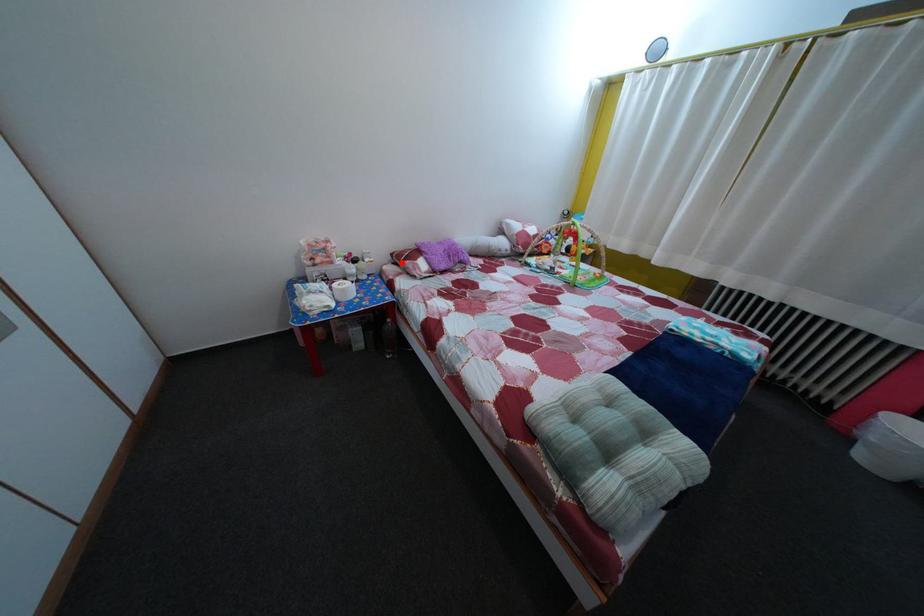
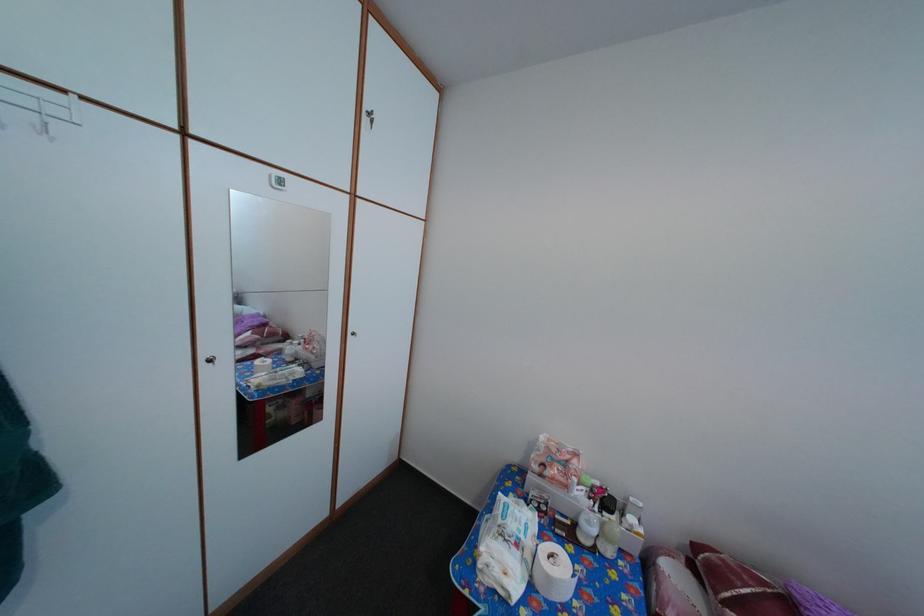
Question: I am providing you with two images of the same scene from different viewpoints. A red point is shown in image1. For the corresponding object point in image2, is it positioned nearer or farther from the camera?

Choices:
 (A) Nearer
 (B) Farther

Answer: (B)